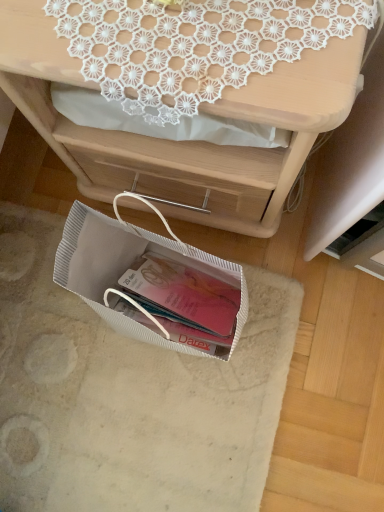
Question: Is matte white desk at upper center facing away from white textured bag at lower center?

Choices:
 (A) no
 (B) yes

Answer: (A)

Question: Can you confirm if matte white desk at upper center is taller than white textured bag at lower center?

Choices:
 (A) yes
 (B) no

Answer: (A)

Question: Considering the relative sizes of matte white desk at upper center and white textured bag at lower center in the image provided, is matte white desk at upper center smaller than white textured bag at lower center?

Choices:
 (A) yes
 (B) no

Answer: (B)

Question: Could you tell me if matte white desk at upper center is turned towards white textured bag at lower center?

Choices:
 (A) yes
 (B) no

Answer: (A)

Question: From a real-world perspective, is matte white desk at upper center positioned under white textured bag at lower center based on gravity?

Choices:
 (A) yes
 (B) no

Answer: (B)

Question: From a real-world perspective, is matte white desk at upper center located higher than white textured bag at lower center?

Choices:
 (A) yes
 (B) no

Answer: (A)

Question: Is white lace doily at upper center further to camera compared to matte white desk at upper center?

Choices:
 (A) yes
 (B) no

Answer: (A)

Question: Can you confirm if white lace doily at upper center is wider than matte white desk at upper center?

Choices:
 (A) yes
 (B) no

Answer: (B)

Question: Considering the relative positions of white lace doily at upper center and matte white desk at upper center in the image provided, is white lace doily at upper center to the right of matte white desk at upper center from the viewer's perspective?

Choices:
 (A) no
 (B) yes

Answer: (B)

Question: Is white lace doily at upper center positioned with its back to matte white desk at upper center?

Choices:
 (A) yes
 (B) no

Answer: (A)

Question: Can you confirm if white lace doily at upper center is bigger than matte white desk at upper center?

Choices:
 (A) yes
 (B) no

Answer: (B)

Question: Can you see white lace doily at upper center touching matte white desk at upper center?

Choices:
 (A) no
 (B) yes

Answer: (A)

Question: Would you say white lace doily at upper center is a long distance from white textured bag at lower center?

Choices:
 (A) no
 (B) yes

Answer: (A)